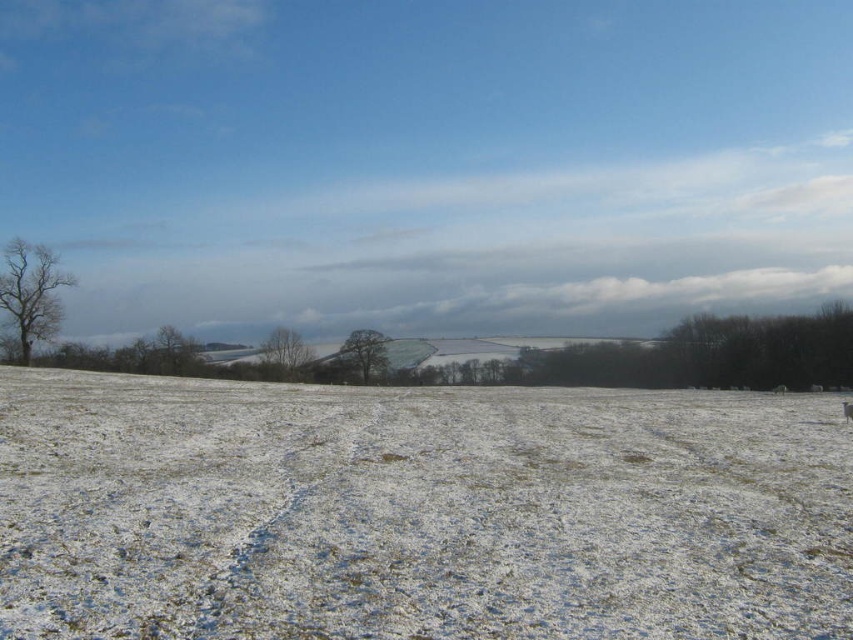
Is point (801, 595) positioned before point (276, 328)?

Yes, point (801, 595) is closer to viewer.

Is point (125, 528) positioned behind point (270, 333)?

No, (125, 528) is closer to viewer.

Locate an element on the screen. white powdery snow at center is located at coordinates (416, 512).

Can you confirm if bare branches at left is shorter than bare tree at center?

Incorrect, bare branches at left's height does not fall short of bare tree at center's.

Who is more forward, (25, 253) or (294, 360)?

Point (25, 253) is in front.

In the scene shown: Who is more forward, (44, 310) or (305, 364)?

Point (44, 310) is in front.

Image resolution: width=853 pixels, height=640 pixels. I want to click on bare branches at left, so click(32, 292).

Does white powdery snow at center lie in front of bare branches at left?

That is True.

Who is higher up, white powdery snow at center or bare branches at left?

bare branches at left is above.

Where is `white powdery snow at center`? Image resolution: width=853 pixels, height=640 pixels. white powdery snow at center is located at coordinates (416, 512).